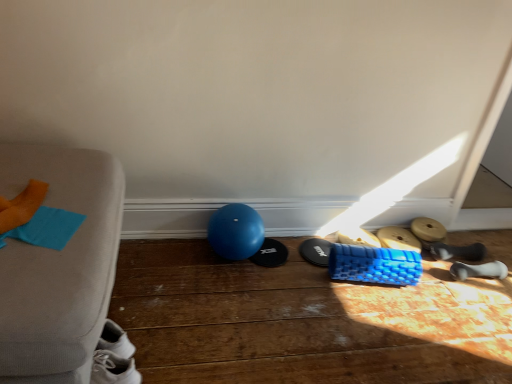
You are a GUI agent. You are given a task and a screenshot of the screen. Output one action in this format:
    pyautogui.click(x=<x>, y=<y>)
    Task: Click on the vacant area that lies in front of blue textured foam roller at center, which ranks as the 2th footwear in left-to-right order
    
    Given the screenshot: What is the action you would take?
    coord(318,288)